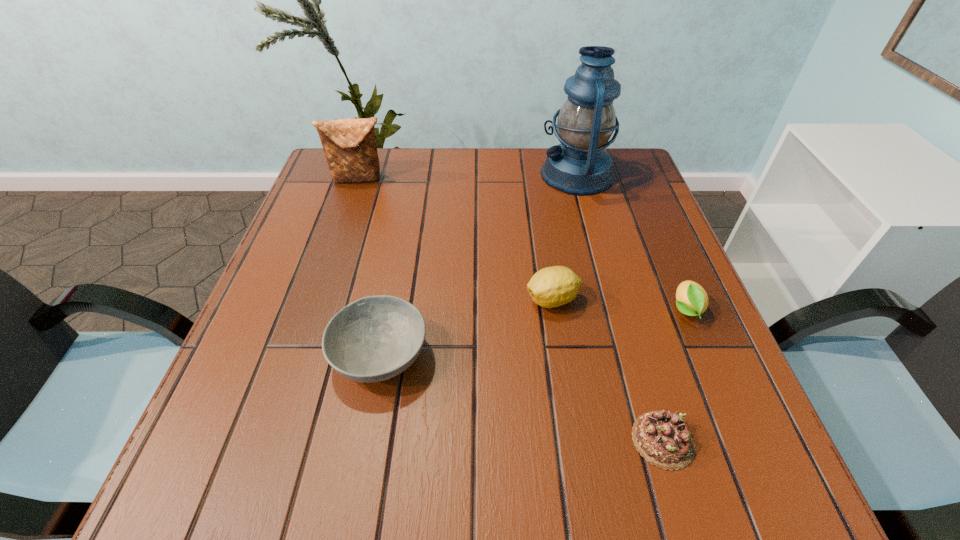
The height and width of the screenshot is (540, 960). In order to click on vacant point at the left edge in this screenshot , I will do `click(312, 223)`.

At what (x,y) coordinates should I click in order to perform the action: click on vacant space at the right edge of the desktop. Please return your answer as a coordinate pair (x, y). The width and height of the screenshot is (960, 540). Looking at the image, I should click on [x=704, y=434].

This screenshot has width=960, height=540. In the image, there is a desktop. In order to click on free space at the far right corner in this screenshot , I will do `click(609, 195)`.

The image size is (960, 540). In order to click on free spot at the near right corner of the desktop in this screenshot , I will do `click(752, 450)`.

You are a GUI agent. You are given a task and a screenshot of the screen. Output one action in this format:
    pyautogui.click(x=<x>, y=<y>)
    Task: Click on the vacant space that's between the clutch bag and the taller lemon
    Image resolution: width=960 pixels, height=540 pixels.
    Given the screenshot: What is the action you would take?
    pyautogui.click(x=456, y=239)

Where is `free space between the right lemon and the left lemon`? The image size is (960, 540). free space between the right lemon and the left lemon is located at coordinates (619, 305).

What are the coordinates of `free space between the tallest object and the rightmost object` in the screenshot? It's located at (631, 242).

Identify the location of free space between the right lemon and the shortest object. coord(674,375).

Locate an element on the screen. The image size is (960, 540). blank region between the clutch bag and the rightmost object is located at coordinates (522, 244).

Find the location of a particular element. free space between the bowl and the tallest object is located at coordinates (478, 265).